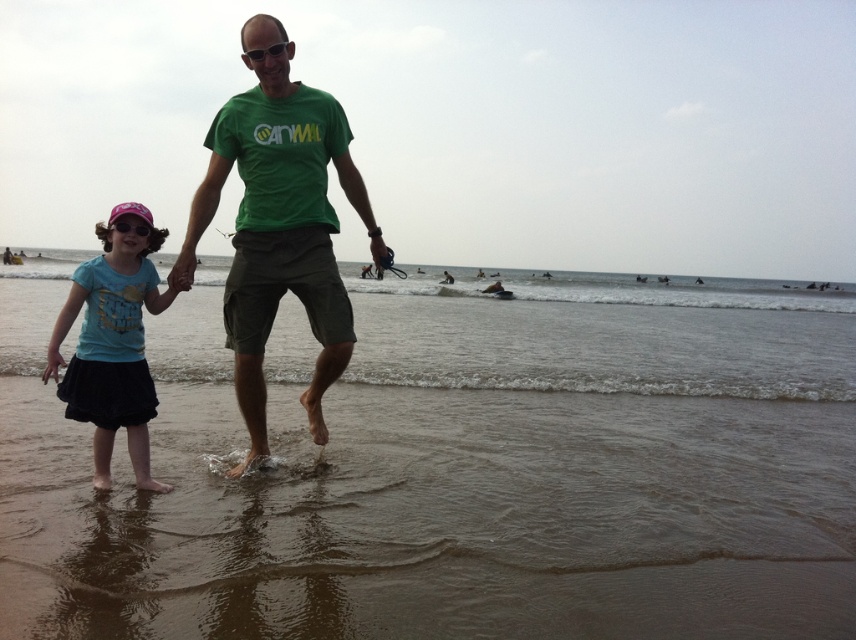
Between green cotton t-shirt at center and pink plastic goggles at left, which one has more height?

green cotton t-shirt at center is taller.

Does green cotton t-shirt at center appear over pink plastic goggles at left?

No, green cotton t-shirt at center is not above pink plastic goggles at left.

Is point (260, 202) in front of point (125, 230)?

No, it is not.

Locate an element on the screen. green cotton t-shirt at center is located at coordinates (278, 224).

Can you confirm if green cotton t-shirt at center is wider than blue cotton shirt at lower left?

Correct, the width of green cotton t-shirt at center exceeds that of blue cotton shirt at lower left.

Which of these two, green cotton t-shirt at center or blue cotton shirt at lower left, stands taller?

Standing taller between the two is green cotton t-shirt at center.

Does point (259, 326) lie behind point (110, 305)?

Yes, it is behind point (110, 305).

The width and height of the screenshot is (856, 640). In order to click on green cotton t-shirt at center in this screenshot , I will do `click(278, 224)`.

Which is in front, point (141, 456) or point (147, 230)?

Point (147, 230) is more forward.

Does point (125, 344) come behind point (125, 221)?

Yes.

Measure the distance between blue cotton shirt at lower left and camera.

blue cotton shirt at lower left and camera are 4.34 meters apart from each other.

Image resolution: width=856 pixels, height=640 pixels. I want to click on blue cotton shirt at lower left, so click(111, 342).